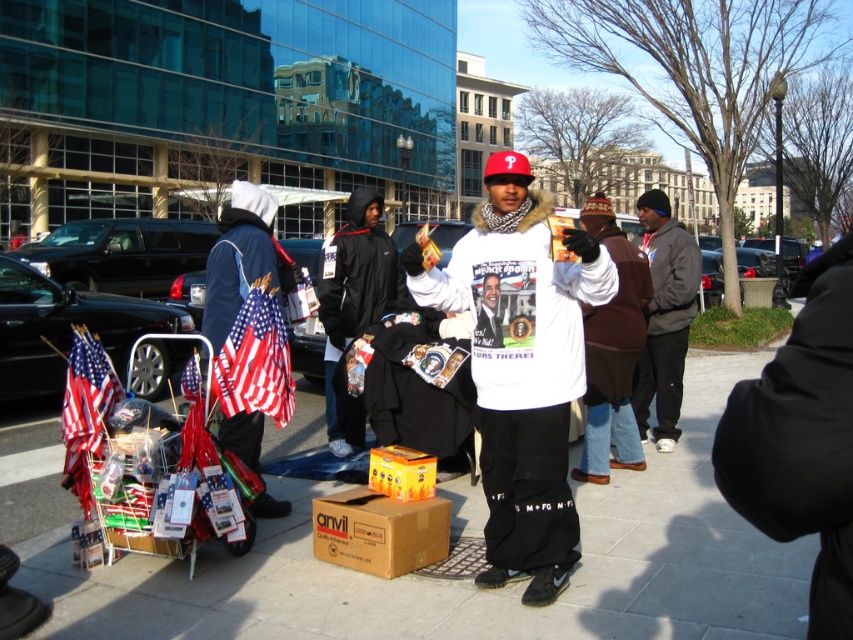
Can you confirm if blue denim jacket at left is positioned to the left of orange cardboard box at center?

Yes, blue denim jacket at left is to the left of orange cardboard box at center.

Does blue denim jacket at left have a larger size compared to orange cardboard box at center?

Actually, blue denim jacket at left might be smaller than orange cardboard box at center.

Find the location of a particular element. blue denim jacket at left is located at coordinates (239, 259).

Does gray fleece jacket at center appear on the right side of orange cardboard box at center?

Indeed, gray fleece jacket at center is positioned on the right side of orange cardboard box at center.

Looking at this image, which is more to the left, gray fleece jacket at center or orange cardboard box at center?

orange cardboard box at center

Is point (665, 285) positioned before point (392, 454)?

No, (665, 285) is behind (392, 454).

The width and height of the screenshot is (853, 640). I want to click on gray fleece jacket at center, so click(665, 317).

From the picture: Can you confirm if brown fuzzy vest at center is bigger than orange cardboard box at center?

Correct, brown fuzzy vest at center is larger in size than orange cardboard box at center.

Between brown fuzzy vest at center and orange cardboard box at center, which one has more height?

With more height is brown fuzzy vest at center.

At what (x,y) coordinates should I click in order to perform the action: click on brown fuzzy vest at center. Please return your answer as a coordinate pair (x, y). This screenshot has height=640, width=853. Looking at the image, I should click on (612, 352).